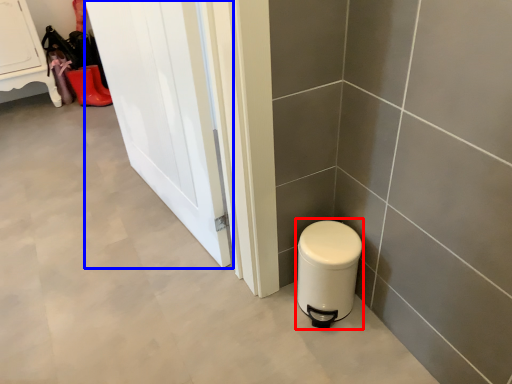
Question: Which object appears closest to the camera in this image, water heater (highlighted by a red box) or door (highlighted by a blue box)?

Choices:
 (A) water heater
 (B) door

Answer: (B)